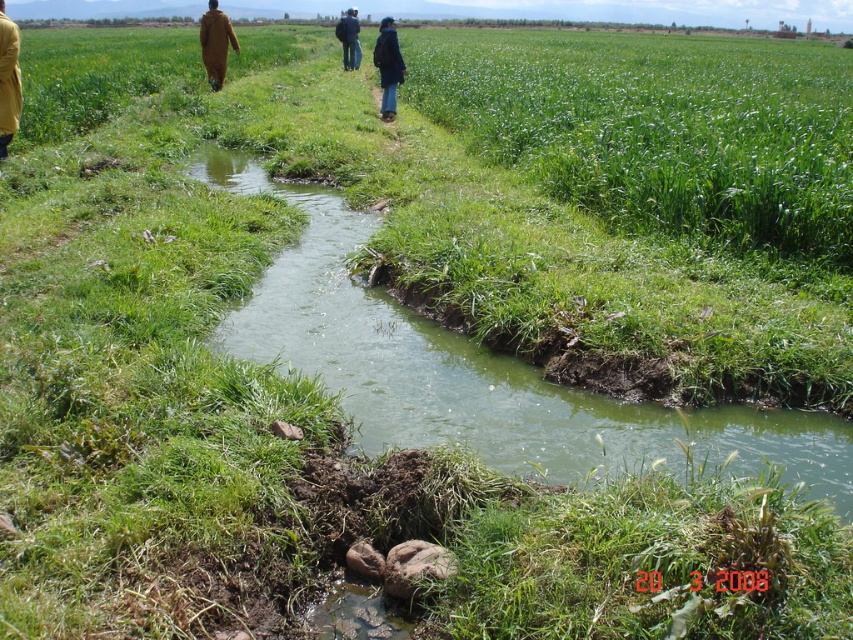
The width and height of the screenshot is (853, 640). What do you see at coordinates (9, 81) in the screenshot? I see `matte yellow coat at left` at bounding box center [9, 81].

Who is taller, matte yellow coat at left or black matte jacket at center?

Standing taller between the two is black matte jacket at center.

Which is behind, point (1, 77) or point (396, 44)?

The point (396, 44) is more distant.

Where is `matte yellow coat at left`? The width and height of the screenshot is (853, 640). matte yellow coat at left is located at coordinates (9, 81).

Is brown woolen coat at upper center thinner than black matte jacket at center?

Correct, brown woolen coat at upper center's width is less than black matte jacket at center's.

Is brown woolen coat at upper center bigger than black matte jacket at center?

Incorrect, brown woolen coat at upper center is not larger than black matte jacket at center.

Does point (221, 42) lie in front of point (393, 45)?

No.

This screenshot has height=640, width=853. I want to click on brown woolen coat at upper center, so click(215, 44).

Can you confirm if matte yellow coat at left is positioned to the left of brown woolen coat at upper center?

Incorrect, matte yellow coat at left is not on the left side of brown woolen coat at upper center.

Who is more distant from viewer, (3,108) or (202,19)?

Positioned behind is point (202,19).

This screenshot has width=853, height=640. Describe the element at coordinates (9, 81) in the screenshot. I see `matte yellow coat at left` at that location.

Locate an element on the screen. The image size is (853, 640). matte yellow coat at left is located at coordinates (9, 81).